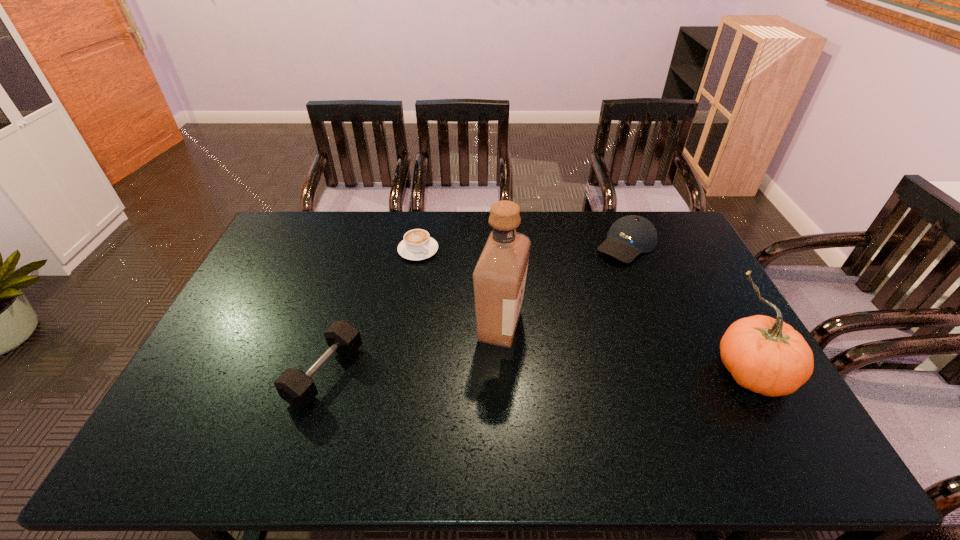
Identify the location of vacant space located 0.140m on the front-facing side of the tallest object. (558, 375).

Locate an element on the screen. The height and width of the screenshot is (540, 960). vacant position located on the front-facing side of the tallest object is located at coordinates (585, 397).

Identify the location of vacant space located on the front-facing side of the baseball cap. (586, 286).

Where is `vacant space situated on the front-facing side of the baseball cap`? The image size is (960, 540). vacant space situated on the front-facing side of the baseball cap is located at coordinates [x=601, y=271].

At what (x,y) coordinates should I click in order to perform the action: click on blank area located 0.360m on the front-facing side of the baseball cap. Please return your answer as a coordinate pair (x, y). Looking at the image, I should click on (553, 319).

Identify the location of free space located 0.110m on the side of the second object from left to right with the handle. The width and height of the screenshot is (960, 540). (447, 277).

At what (x,y) coordinates should I click in order to perform the action: click on vacant space located 0.230m on the side of the second object from left to right with the handle. Please return your answer as a coordinate pair (x, y). Looking at the image, I should click on (468, 297).

Locate an element on the screen. free space located on the side of the second object from left to right with the handle is located at coordinates (460, 288).

In order to click on baseball cap present at the far edge in this screenshot , I will do `click(629, 236)`.

Locate an element on the screen. This screenshot has width=960, height=540. cappuccino that is at the far edge is located at coordinates (417, 245).